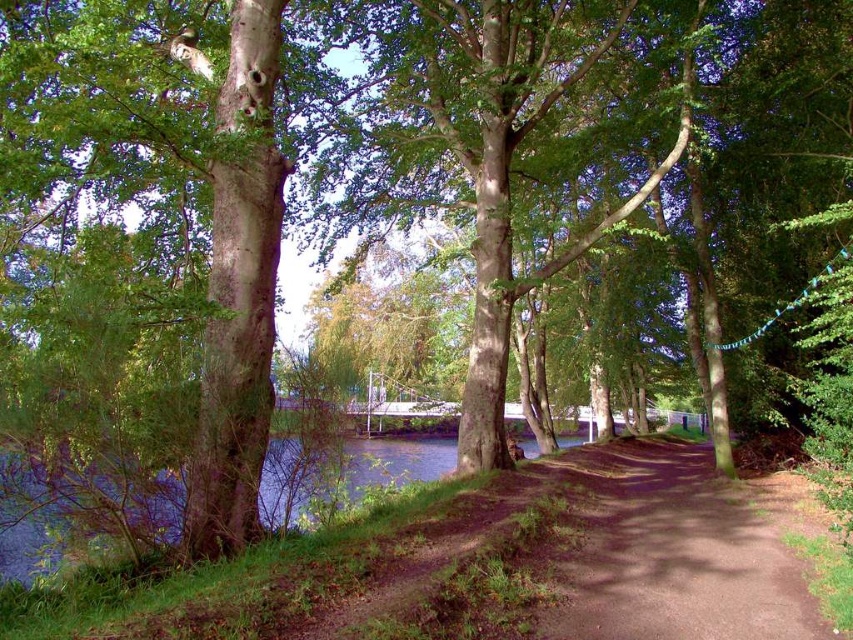
Question: Which of the following is the closest to the observer?

Choices:
 (A) green leafy tree at center
 (B) brown dirt path at center

Answer: (B)

Question: Can you confirm if green leafy tree at center is bigger than brown dirt path at center?

Choices:
 (A) yes
 (B) no

Answer: (A)

Question: Does green leafy tree at center appear on the left side of brown dirt path at center?

Choices:
 (A) no
 (B) yes

Answer: (B)

Question: From the image, what is the correct spatial relationship of green leafy tree at center in relation to brown dirt path at center?

Choices:
 (A) above
 (B) below

Answer: (A)

Question: Among these points, which one is farthest from the camera?

Choices:
 (A) (616, 538)
 (B) (430, 92)

Answer: (B)